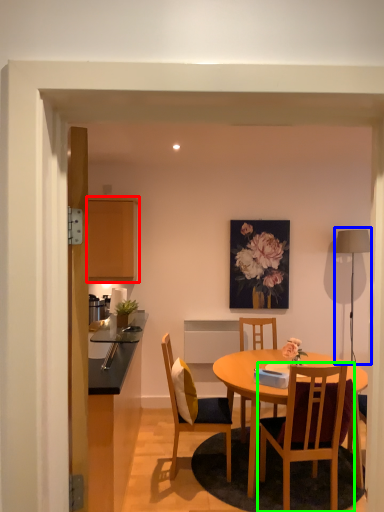
Question: Based on their relative distances, which object is nearer to cabinetry (highlighted by a red box)? Choose from lamp (highlighted by a blue box) and chair (highlighted by a green box).

Choices:
 (A) lamp
 (B) chair

Answer: (B)